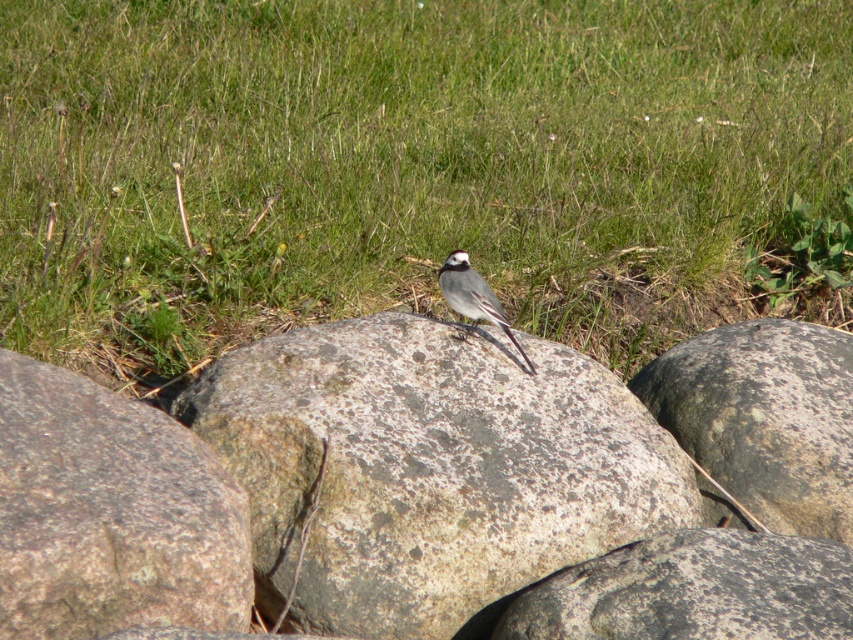
Between point (804, 636) and point (448, 285), which one is positioned in front?

Point (804, 636) is in front.

Between speckled rock at center and white matte bird at center, which one has less height?

Standing shorter between the two is speckled rock at center.

Measure the distance between point (701, 620) and camera.

10.13 feet

The width and height of the screenshot is (853, 640). In order to click on speckled rock at center in this screenshot , I will do `click(693, 592)`.

Is green grass at center to the right of speckled rock at center from the viewer's perspective?

No, green grass at center is not to the right of speckled rock at center.

Is green grass at center closer to the viewer compared to speckled rock at center?

That is False.

Locate an element on the screen. green grass at center is located at coordinates tap(413, 170).

Where is `green grass at center`? green grass at center is located at coordinates tap(413, 170).

At what (x,y) coordinates should I click in order to perform the action: click on speckled stone boulder at center. Please return your answer as a coordinate pair (x, y). The height and width of the screenshot is (640, 853). Looking at the image, I should click on (428, 470).

Does point (445, 586) come farther from viewer compared to point (758, 385)?

No, it is not.

The height and width of the screenshot is (640, 853). Find the location of `speckled stone boulder at center`. speckled stone boulder at center is located at coordinates (428, 470).

Identify the location of speckled stone boulder at center. The width and height of the screenshot is (853, 640). (428, 470).